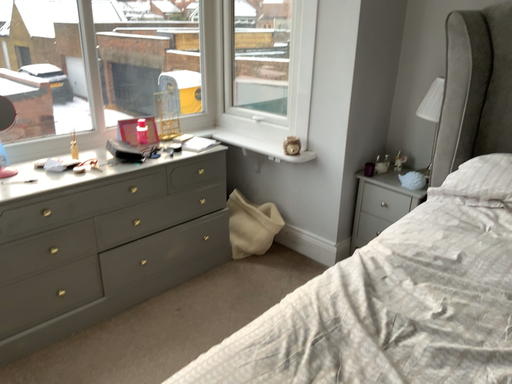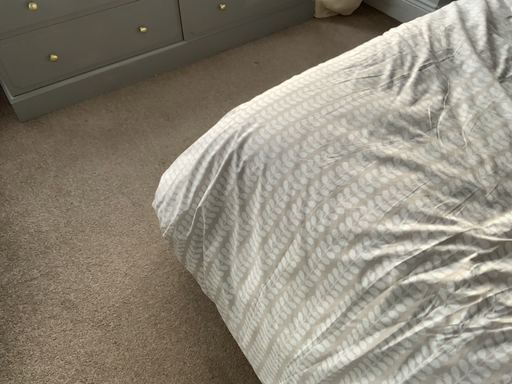
Question: Which way did the camera rotate in the video?

Choices:
 (A) rotated right
 (B) rotated left

Answer: (B)